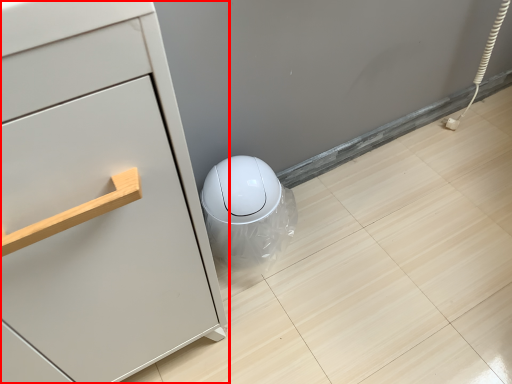
Question: From the image's perspective, where is chest of drawers (annotated by the red box) located relative to porcelain?

Choices:
 (A) above
 (B) below

Answer: (B)